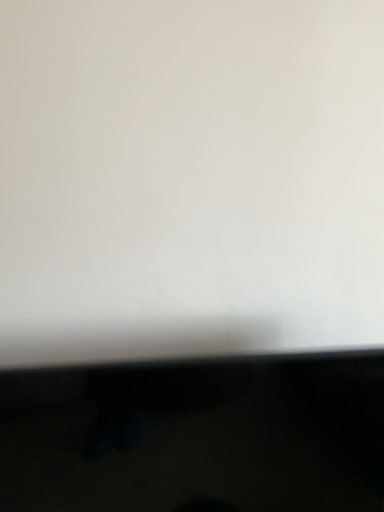
What do you see at coordinates (196, 437) in the screenshot? The width and height of the screenshot is (384, 512). I see `black matte table at bottom` at bounding box center [196, 437].

Find the location of a particular element. The image size is (384, 512). black matte table at bottom is located at coordinates (196, 437).

At what (x,y) coordinates should I click in order to perform the action: click on black matte table at bottom. Please return your answer as a coordinate pair (x, y). Looking at the image, I should click on (196, 437).